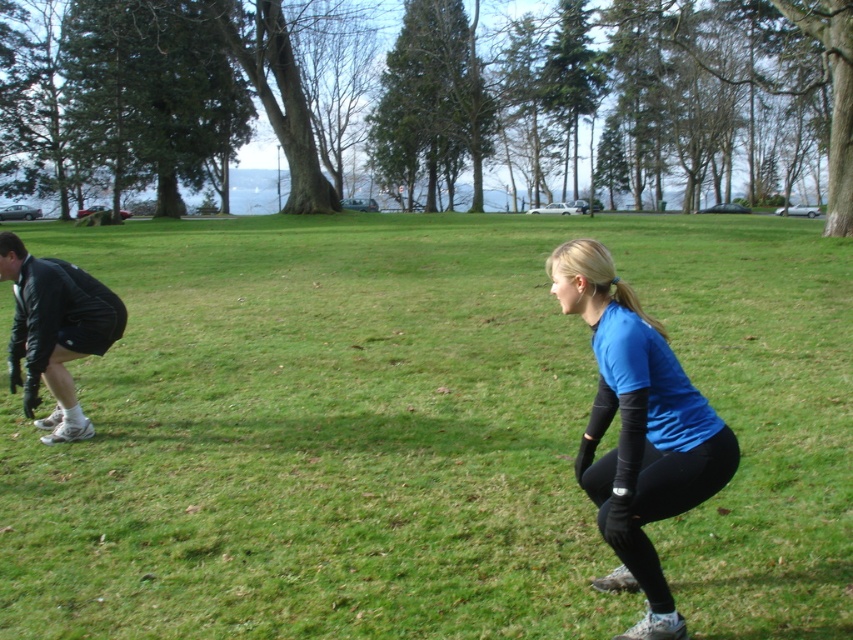
Measure the distance from blue fabric shirt at center to black leather jacket at lower left.

4.25 meters

Can you confirm if blue fabric shirt at center is wider than black leather jacket at lower left?

No, blue fabric shirt at center is not wider than black leather jacket at lower left.

Which is behind, point (677, 449) or point (119, 317)?

The point (119, 317) is more distant.

Locate an element on the screen. blue fabric shirt at center is located at coordinates (637, 429).

Is blue fabric at center taller than black leather jacket at lower left?

Correct, blue fabric at center is much taller as black leather jacket at lower left.

Between point (115, 449) and point (32, 372), which one is positioned in front?

Point (32, 372) is in front.

Is point (486, 492) farther from viewer compared to point (22, 330)?

No, it is in front of (22, 330).

Image resolution: width=853 pixels, height=640 pixels. Find the location of `blue fabric at center`. blue fabric at center is located at coordinates (421, 433).

Who is positioned more to the left, blue fabric at center or blue fabric shirt at center?

blue fabric at center

Is blue fabric at center wider than blue fabric shirt at center?

Indeed, blue fabric at center has a greater width compared to blue fabric shirt at center.

Is point (704, 369) positioned before point (605, 380)?

That is False.

What are the coordinates of `blue fabric at center` in the screenshot? It's located at (421, 433).